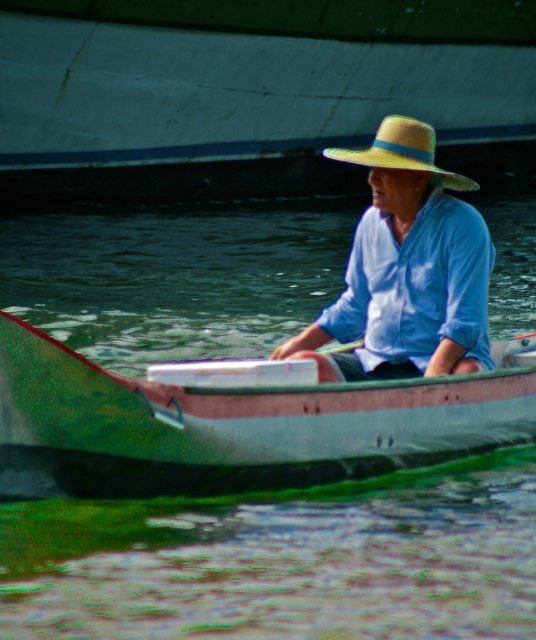
You are standing on the shore and see the green painted wood boat at center and the light blue cotton shirt at center. Which object is closer to you?

The green painted wood boat at center is closer to you because the light blue cotton shirt at center is behind it.